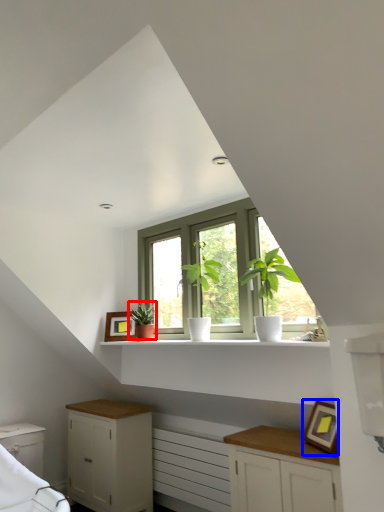
Question: Which of the following is the closest to the observer, houseplant (highlighted by a red box) or picture frame (highlighted by a blue box)?

Choices:
 (A) houseplant
 (B) picture frame

Answer: (B)